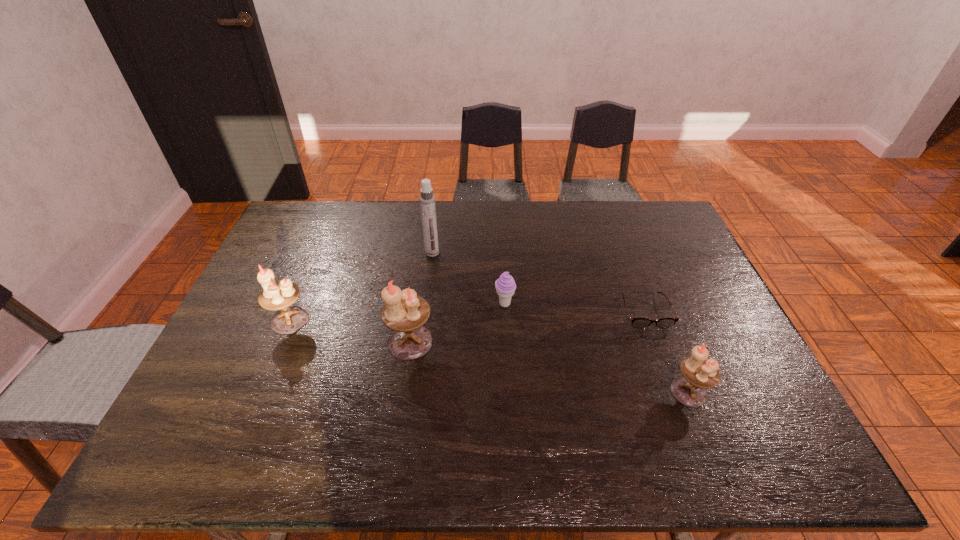
Identify the location of the leftmost object. Image resolution: width=960 pixels, height=540 pixels. (280, 295).

Locate an element on the screen. This screenshot has height=540, width=960. the second tallest candle holder is located at coordinates (280, 295).

Where is `the second candle holder from left to right`? The image size is (960, 540). the second candle holder from left to right is located at coordinates [x=405, y=313].

Where is `the nearest candle holder`? This screenshot has height=540, width=960. the nearest candle holder is located at coordinates (699, 373).

Where is `the nearest object`? Image resolution: width=960 pixels, height=540 pixels. the nearest object is located at coordinates (699, 373).

I want to click on the shortest object, so click(x=637, y=323).

The height and width of the screenshot is (540, 960). Identify the location of the farthest object. (427, 200).

Where is `the fifth tallest object`? The image size is (960, 540). the fifth tallest object is located at coordinates (505, 285).

The height and width of the screenshot is (540, 960). What are the coordinates of `icecream` in the screenshot? It's located at (505, 285).

In order to click on vacant space situated 0.190m on the back of the leftmost object in this screenshot , I will do [x=314, y=264].